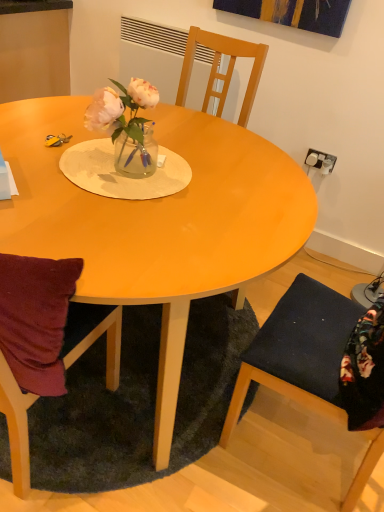
In order to face dark blue fabric chair at lower right, should I rotate leftwards or rightwards?

To align with it, rotate right about 22.464°.

The height and width of the screenshot is (512, 384). Describe the element at coordinates (157, 221) in the screenshot. I see `matte wood table at center` at that location.

Locate an element on the screen. dark blue fabric chair at lower right is located at coordinates (299, 351).

Is dark green shaggy rug at lower center looking in the opposite direction of translucent glass vase at center?

No, dark green shaggy rug at lower center is not facing the opposite direction of translucent glass vase at center.

Is dark green shaggy rug at lower center next to translucent glass vase at center and touching it?

No, dark green shaggy rug at lower center is not making contact with translucent glass vase at center.

Does dark green shaggy rug at lower center have a greater height compared to translucent glass vase at center?

No.

In the scene shown: From the image's perspective, is dark green shaggy rug at lower center above translucent glass vase at center?

No, from the image's perspective, dark green shaggy rug at lower center is not over translucent glass vase at center.

Considering their positions, is translucent glass vase at center located in front of or behind dark green shaggy rug at lower center?

translucent glass vase at center is positioned closer to the viewer than dark green shaggy rug at lower center.

From the image's perspective, does translucent glass vase at center appear higher than dark green shaggy rug at lower center?

Yes, from the image's perspective, translucent glass vase at center is on top of dark green shaggy rug at lower center.

Consider the image. Between translucent glass vase at center and dark green shaggy rug at lower center, which one appears on the left side from the viewer's perspective?

From the viewer's perspective, dark green shaggy rug at lower center appears more on the left side.

Which is farther, (31,228) or (258,333)?

The point (258,333) is farther from the camera.

Can you confirm if matte wood table at center is taller than dark blue fabric chair at lower right?

In fact, matte wood table at center may be shorter than dark blue fabric chair at lower right.

Is matte wood table at center wider or thinner than dark blue fabric chair at lower right?

Considering their sizes, matte wood table at center looks broader than dark blue fabric chair at lower right.

Where is `chair that appears in front of the matte wood table at center`? chair that appears in front of the matte wood table at center is located at coordinates (299, 351).

Considering the sizes of dark blue fabric chair at lower right and translucent glass vase at center in the image, is dark blue fabric chair at lower right taller or shorter than translucent glass vase at center?

Clearly, dark blue fabric chair at lower right is taller compared to translucent glass vase at center.

Is dark blue fabric chair at lower right positioned before translucent glass vase at center?

Yes.

Between dark blue fabric chair at lower right and translucent glass vase at center, which one has smaller size?

Smaller between the two is translucent glass vase at center.

In the scene shown: Is dark blue fabric chair at lower right beside matte wood table at center?

They are not placed beside each other.

Does dark blue fabric chair at lower right turn towards matte wood table at center?

Yes, dark blue fabric chair at lower right is facing matte wood table at center.

Is dark blue fabric chair at lower right taller than matte wood table at center?

Correct, dark blue fabric chair at lower right is much taller as matte wood table at center.

At what (x,y) coordinates should I click in order to perform the action: click on desk to the left of dark blue fabric chair at lower right. Please return your answer as a coordinate pair (x, y). Looking at the image, I should click on (157, 221).

From the image's perspective, is matte wood table at center above or below dark green shaggy rug at lower center?

matte wood table at center is situated higher than dark green shaggy rug at lower center in the image.

From their relative heights in the image, would you say matte wood table at center is taller or shorter than dark green shaggy rug at lower center?

Considering their sizes, matte wood table at center has more height than dark green shaggy rug at lower center.

Is matte wood table at center far from dark green shaggy rug at lower center?

No.

What's the angular difference between matte wood table at center and dark green shaggy rug at lower center's facing directions?

The facing directions of matte wood table at center and dark green shaggy rug at lower center are 0.00021 degrees apart.

From the picture: From a real-world perspective, is translucent glass vase at center located higher than dark blue fabric chair at lower right?

Yes, from a real-world perspective, translucent glass vase at center is above dark blue fabric chair at lower right.

Is point (150, 125) less distant than point (294, 357)?

No, (150, 125) is further to viewer.

From the image's perspective, does translucent glass vase at center appear lower than dark blue fabric chair at lower right?

No.

Considering the relative positions of translucent glass vase at center and dark blue fabric chair at lower right in the image provided, is translucent glass vase at center behind dark blue fabric chair at lower right?

Yes, translucent glass vase at center is further from the camera.

You are a GUI agent. You are given a task and a screenshot of the screen. Output one action in this format:
    pyautogui.click(x=<x>, y=<y>)
    Task: Click on the houseplant lying in front of the dark green shaggy rug at lower center
    
    Given the screenshot: What is the action you would take?
    pyautogui.click(x=126, y=124)

You are a GUI agent. You are given a task and a screenshot of the screen. Output one action in this format:
    pyautogui.click(x=<x>, y=<y>)
    Task: Click on the houseplant that appears on the right of dark green shaggy rug at lower center
    The width and height of the screenshot is (384, 512).
    Given the screenshot: What is the action you would take?
    pyautogui.click(x=126, y=124)

Which object lies further to the anchor point dark green shaggy rug at lower center, dark blue fabric chair at lower right or translucent glass vase at center?

translucent glass vase at center is further to dark green shaggy rug at lower center.

Looking at the image, which one is located further to dark green shaggy rug at lower center, translucent glass vase at center or dark blue fabric chair at lower right?

translucent glass vase at center is positioned further to the anchor dark green shaggy rug at lower center.

When comparing their distances from translucent glass vase at center, does dark green shaggy rug at lower center or dark blue fabric chair at lower right seem further?

Based on the image, dark green shaggy rug at lower center appears to be further to translucent glass vase at center.

Based on the photo, looking at the image, which one is located closer to translucent glass vase at center, dark blue fabric chair at lower right or matte wood table at center?

matte wood table at center is closer to translucent glass vase at center.

From the image, which object appears to be nearer to dark blue fabric chair at lower right, matte wood table at center or translucent glass vase at center?

matte wood table at center lies closer to dark blue fabric chair at lower right than the other object.

Based on the photo, when comparing their distances from dark blue fabric chair at lower right, does translucent glass vase at center or matte wood table at center seem further?

→ translucent glass vase at center lies further to dark blue fabric chair at lower right than the other object.

Based on their spatial positions, is dark blue fabric chair at lower right or translucent glass vase at center further from matte wood table at center?

dark blue fabric chair at lower right.

From the image, which object appears to be nearer to matte wood table at center, translucent glass vase at center or dark blue fabric chair at lower right?

The object closer to matte wood table at center is translucent glass vase at center.

What are the coordinates of `mat between matte wood table at center and dark blue fabric chair at lower right from left to right` in the screenshot? It's located at (138, 402).

You are a GUI agent. You are given a task and a screenshot of the screen. Output one action in this format:
    pyautogui.click(x=<x>, y=<y>)
    Task: Click on the chair between translucent glass vase at center and dark green shaggy rug at lower center in the up-down direction
    This screenshot has height=512, width=384.
    Given the screenshot: What is the action you would take?
    pyautogui.click(x=299, y=351)

At what (x,y) coordinates should I click in order to perform the action: click on houseplant located between matte wood table at center and dark blue fabric chair at lower right in the left-right direction. Please return your answer as a coordinate pair (x, y). This screenshot has width=384, height=512. Looking at the image, I should click on (126, 124).

Where is `desk between translucent glass vase at center and dark green shaggy rug at lower center vertically`? desk between translucent glass vase at center and dark green shaggy rug at lower center vertically is located at coordinates (157, 221).